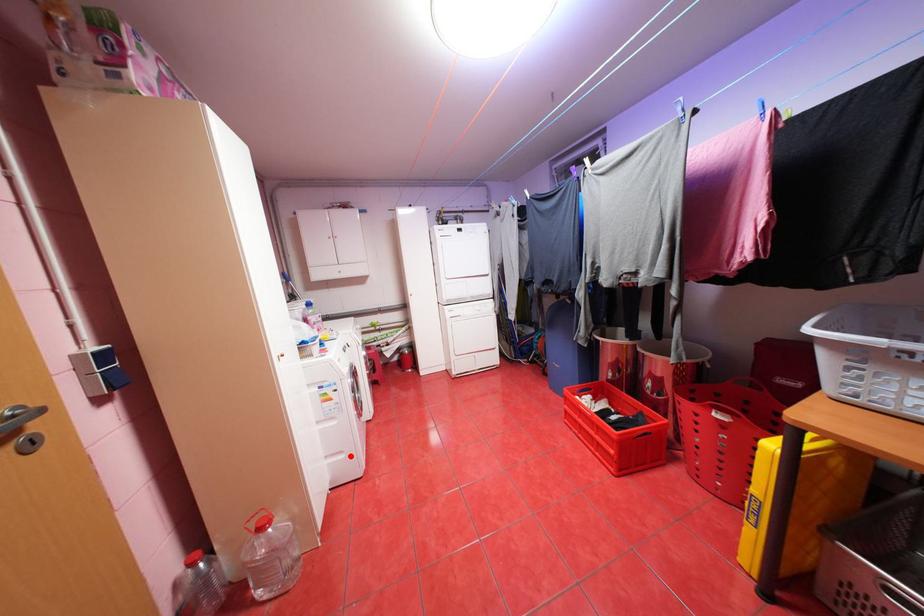
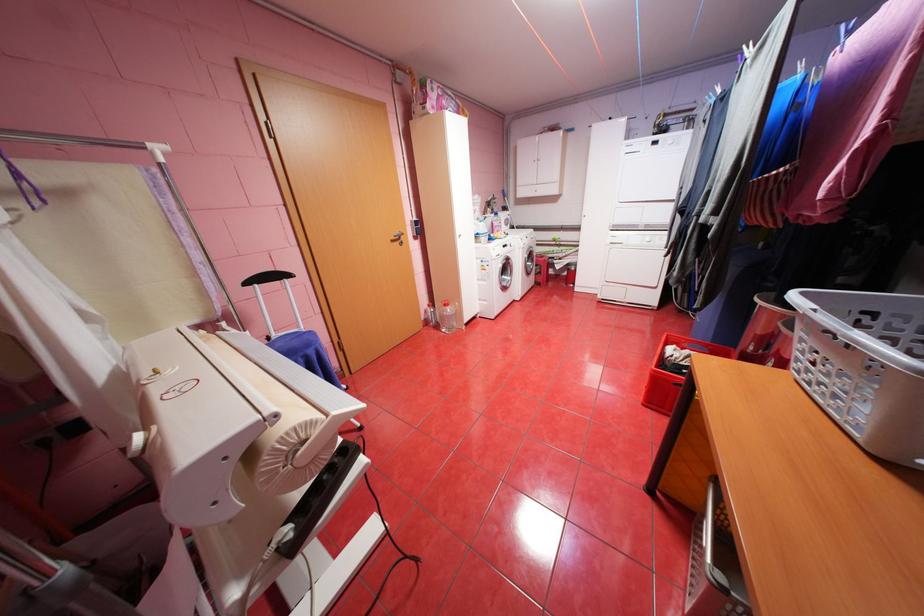
Find the pixel in the second image that matches the highlighted location in the first image.

(494, 302)